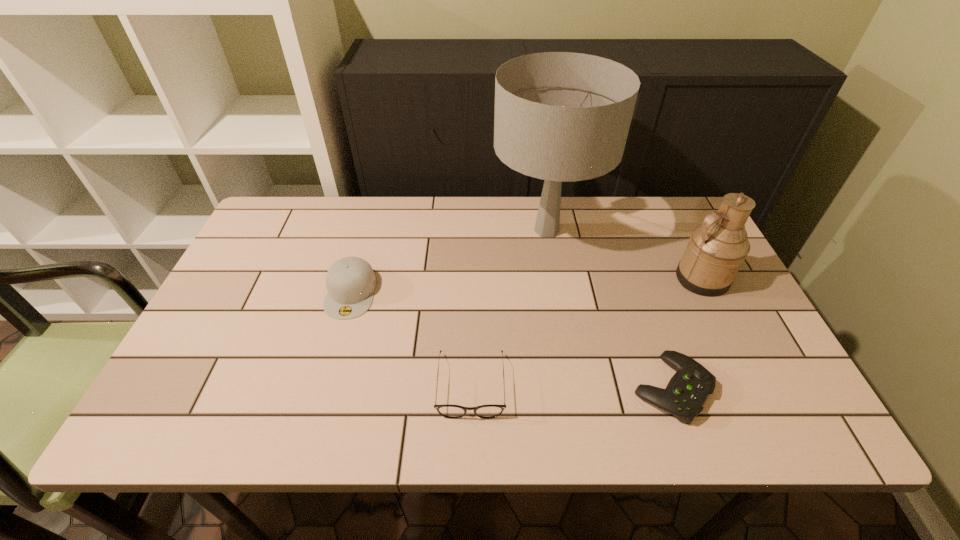
Find the location of `the tallest object`. the tallest object is located at coordinates (561, 117).

Where is `the rightmost object`? Image resolution: width=960 pixels, height=540 pixels. the rightmost object is located at coordinates pyautogui.click(x=717, y=248).

Identify the location of pitcher. (717, 248).

You are a GUI agent. You are given a task and a screenshot of the screen. Output one action in this format:
    pyautogui.click(x=<x>, y=<y>)
    Task: Click on the leftmost object
    
    Given the screenshot: What is the action you would take?
    [350, 281]

Locate an element on the screen. The height and width of the screenshot is (540, 960). cap is located at coordinates (350, 281).

Locate an element on the screen. Image resolution: width=960 pixels, height=540 pixels. the second shortest object is located at coordinates (449, 411).

Where is `control`? This screenshot has height=540, width=960. control is located at coordinates coord(687,391).

Where is `free region located on the front-facing side of the lampshade`? The width and height of the screenshot is (960, 540). free region located on the front-facing side of the lampshade is located at coordinates (432, 231).

Where is `vacant region located 0.090m on the front-facing side of the lampshade`? The width and height of the screenshot is (960, 540). vacant region located 0.090m on the front-facing side of the lampshade is located at coordinates (462, 231).

I want to click on free space located on the front-facing side of the lampshade, so click(x=376, y=231).